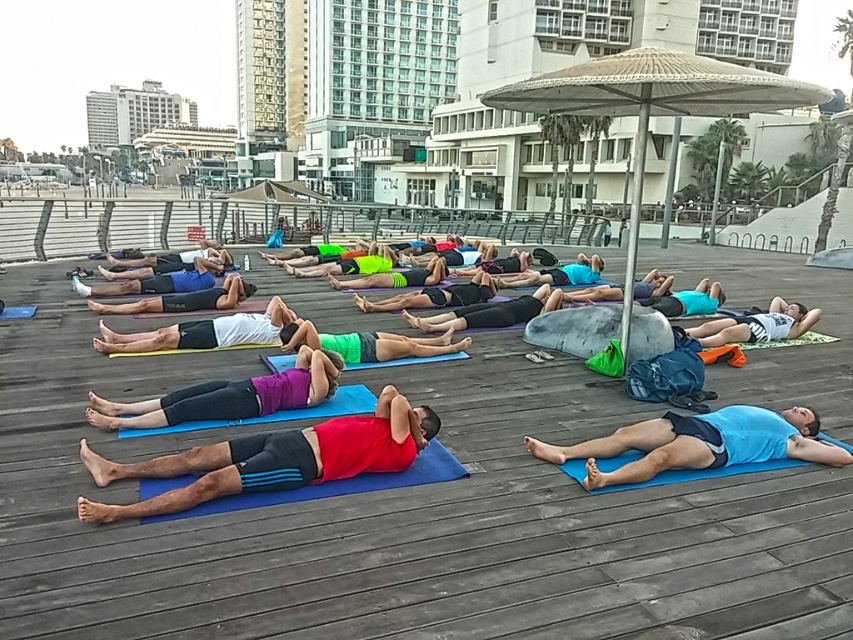
Question: Considering the real-world distances, which object is closest to the purple matte yoga mat at center?

Choices:
 (A) blue matte yoga mat at lower right
 (B) white cotton shirt at center
 (C) blue rubber yoga mat at center

Answer: (C)

Question: Is purple matte yoga mat at center thinner than white cotton shirt at center?

Choices:
 (A) yes
 (B) no

Answer: (A)

Question: Which object is the closest to the red matte tank top at center?

Choices:
 (A) purple matte yoga mat at center
 (B) blue matte yoga mat at lower right

Answer: (A)

Question: Is blue rubber mat at center positioned at the back of blue rubber yoga mat at center?

Choices:
 (A) yes
 (B) no

Answer: (B)

Question: Which object appears farthest from the camera in this image?

Choices:
 (A) blue rubber mat at center
 (B) blue matte yoga mat at lower right
 (C) white cotton shirt at center
 (D) purple matte yoga mat at center

Answer: (C)

Question: Can you confirm if white cotton shirt at center is positioned to the left of blue rubber yoga mat at center?

Choices:
 (A) no
 (B) yes

Answer: (A)